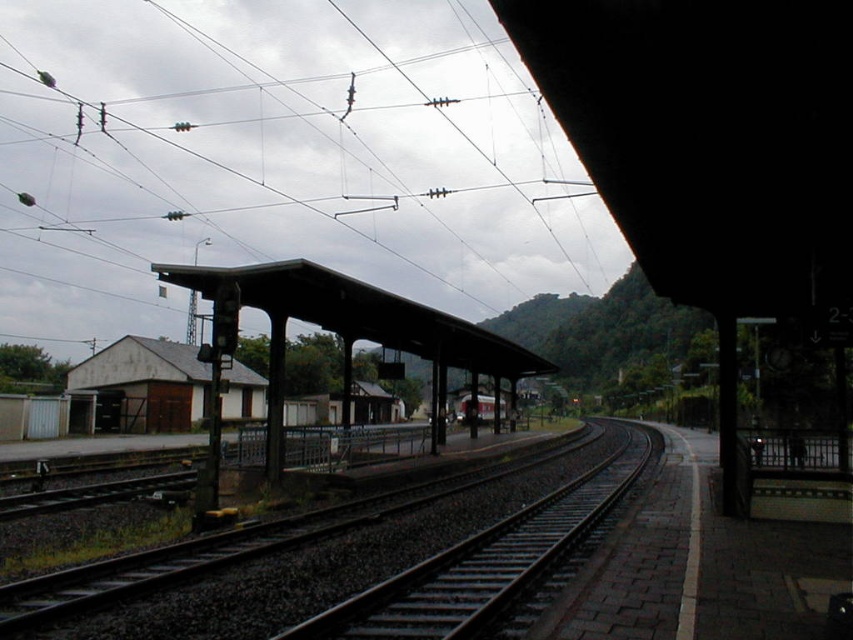
Who is positioned more to the right, smooth metal train track at center or red painted metal train at center?

From the viewer's perspective, smooth metal train track at center appears more on the right side.

Can you confirm if smooth metal train track at center is wider than red painted metal train at center?

Yes.

Which is behind, point (589, 520) or point (463, 417)?

Point (463, 417)

The width and height of the screenshot is (853, 640). Find the location of `smooth metal train track at center`. smooth metal train track at center is located at coordinates (486, 563).

Is metallic wires at upper center to the right of smooth metal train track at center from the viewer's perspective?

No, metallic wires at upper center is not to the right of smooth metal train track at center.

From the picture: Can you confirm if metallic wires at upper center is wider than smooth metal train track at center?

Yes, metallic wires at upper center is wider than smooth metal train track at center.

Which is behind, point (132, 237) or point (659, 442)?

Point (132, 237)

What are the coordinates of `metallic wires at upper center` in the screenshot? It's located at (280, 150).

Is metallic wires at upper center wider than dark gray metal platform at center?

Yes, metallic wires at upper center is wider than dark gray metal platform at center.

Is metallic wires at upper center further to the viewer compared to dark gray metal platform at center?

Yes, it is.

Does point (550, 253) come farther from viewer compared to point (270, 358)?

That is True.

I want to click on metallic wires at upper center, so click(x=280, y=150).